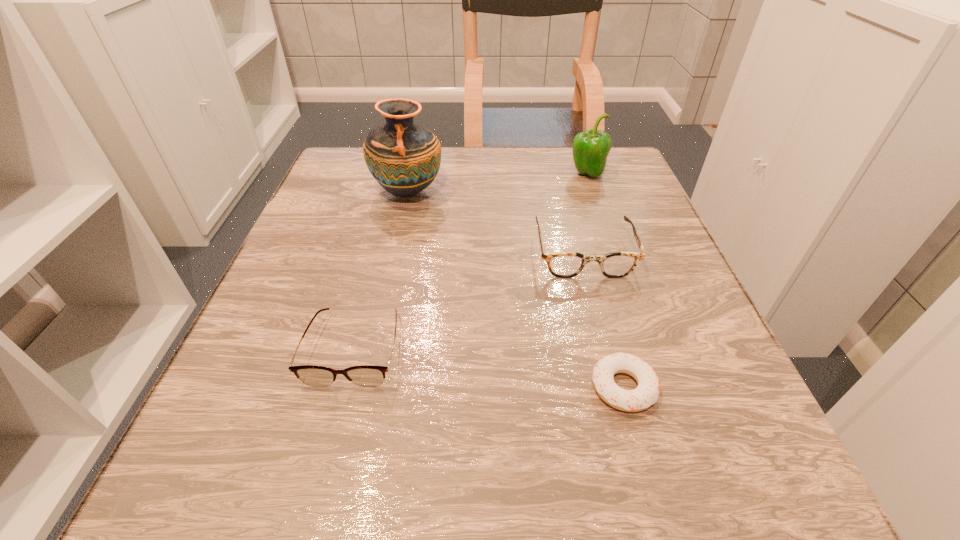
I want to click on vacant area between the right spectacles and the tallest object, so click(495, 222).

Find the location of a particular element. The height and width of the screenshot is (540, 960). vacant point located between the bell pepper and the shortest object is located at coordinates pyautogui.click(x=605, y=281).

This screenshot has height=540, width=960. Identify the location of free space between the shorter spectacles and the right spectacles. (468, 300).

Locate an element on the screen. The height and width of the screenshot is (540, 960). empty space between the taller spectacles and the shortest object is located at coordinates (603, 320).

At what (x,y) coordinates should I click in order to perform the action: click on vacant area that lies between the second tallest object and the left spectacles. Please return your answer as a coordinate pair (x, y). The width and height of the screenshot is (960, 540). Looking at the image, I should click on (470, 261).

Locate an element on the screen. vacant area that lies between the tallest object and the bell pepper is located at coordinates (497, 183).

You are a GUI agent. You are given a task and a screenshot of the screen. Output one action in this format:
    pyautogui.click(x=<x>, y=<y>)
    Task: Click on the free area in between the doughnut and the farther spectacles
    The height and width of the screenshot is (540, 960).
    Given the screenshot: What is the action you would take?
    pyautogui.click(x=603, y=320)

Locate an element on the screen. The width and height of the screenshot is (960, 540). free point between the left spectacles and the pottery is located at coordinates (381, 270).

Identify the location of object that stands as the fourth closest to the nearer spectacles. (590, 148).

Find the location of a particular element. the third closest object relative to the shortest object is located at coordinates (404, 158).